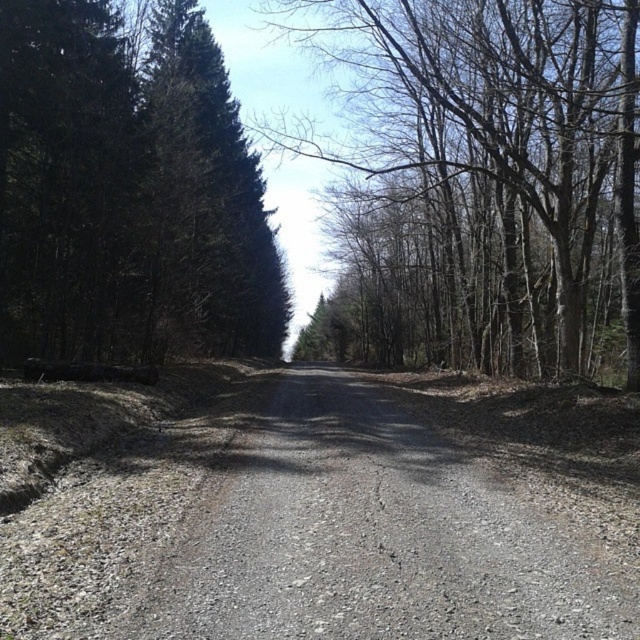
You are standing at the entrance of the forest path and see two points marked on the ground ahead of you. The first point is at coordinates point (417, 321) and the second is at point (422, 609). Which point is closer to you as you walk along the path?

Point (417, 321) is closer to you because it is further to the viewer than point (422, 609), meaning it is nearer along the path.

You are standing at the entrance of the forest path and notice the bare branches at center. Based on the scene description, can you determine the direction of the sunlight relative to your position?

The sunlight is coming from the right side of the scene because the deciduous trees on the right have sunlight filtering through their bare branches, creating contrast with the shaded areas on the left where the evergreens are densely packed.